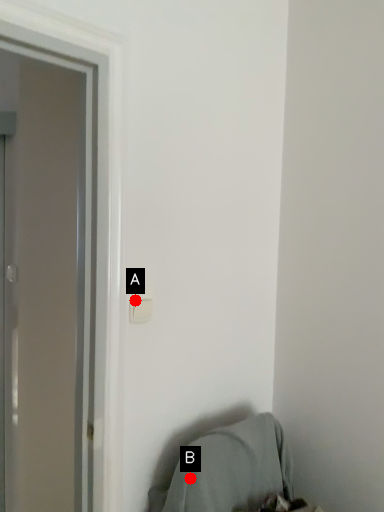
Question: Two points are circled on the image, labeled by A and B beside each circle. Which of the following is the farthest from the observer?

Choices:
 (A) A is further
 (B) B is further

Answer: (B)